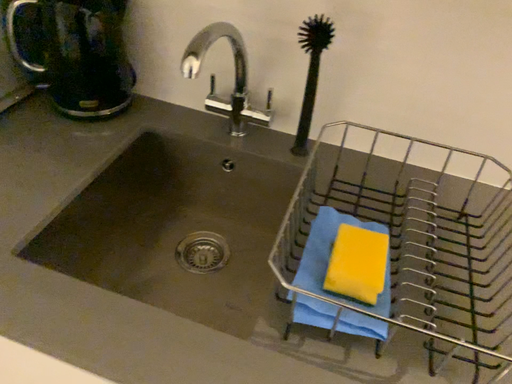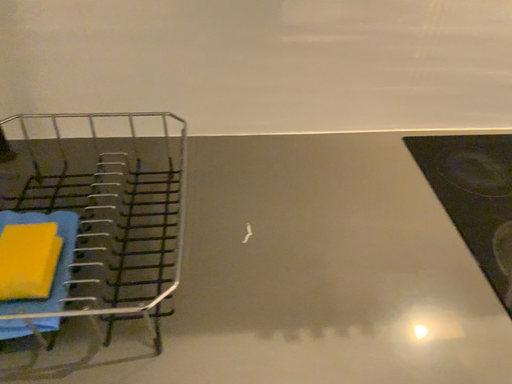
Question: Which way did the camera rotate in the video?

Choices:
 (A) rotated right
 (B) rotated left

Answer: (A)